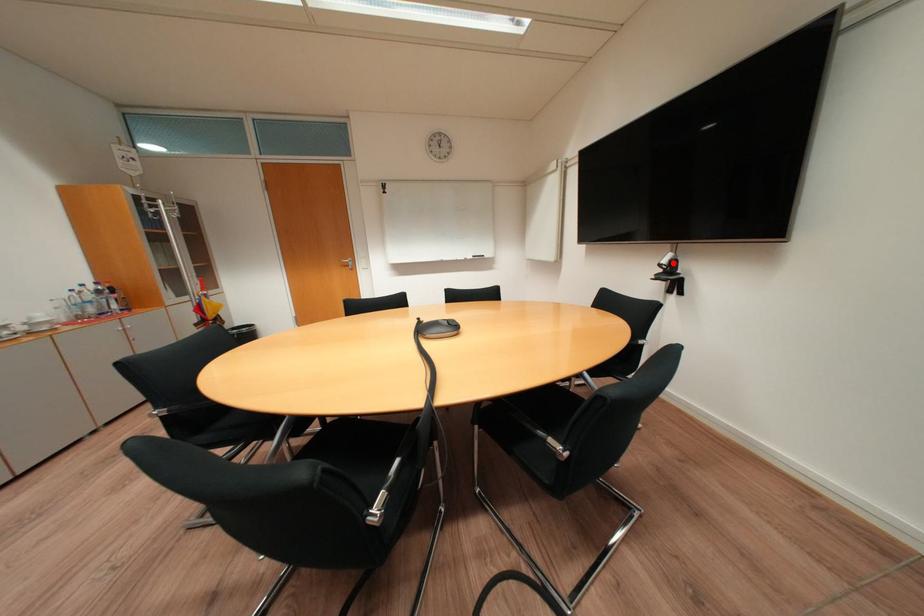
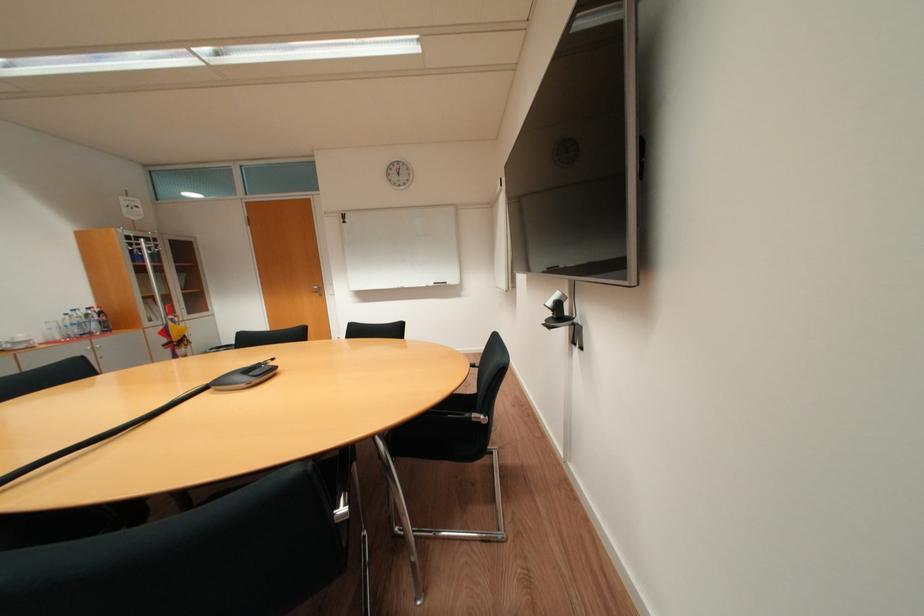
Where in the second image is the point corresponding to the highlighted location from the first image?

(558, 304)